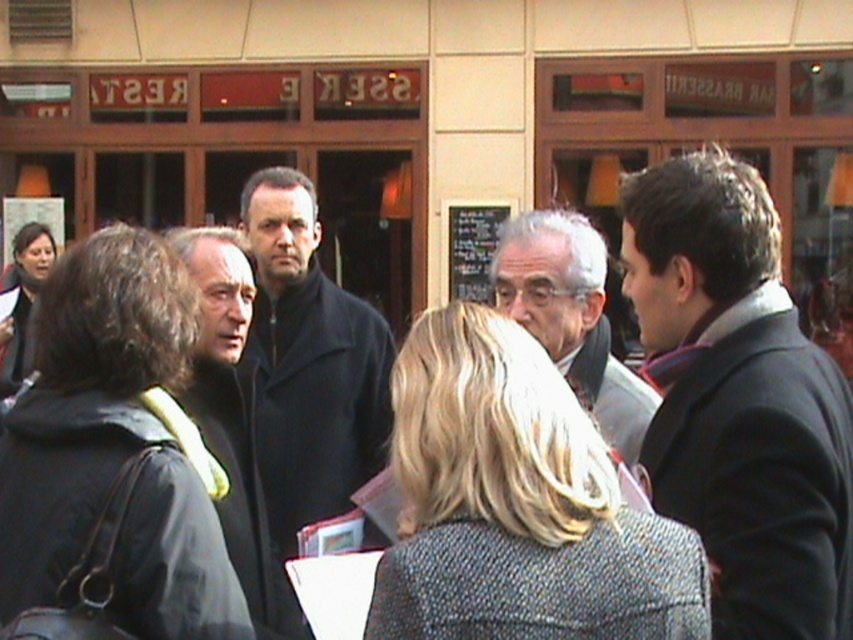
You are a GUI agent. You are given a task and a screenshot of the screen. Output one action in this format:
    pyautogui.click(x=<x>, y=<y>)
    Task: Click on the dark gray wool coat at right
    Image resolution: width=853 pixels, height=640 pixels.
    Given the screenshot: What is the action you would take?
    pyautogui.click(x=740, y=401)

Is point (679, 352) farther from viewer compared to point (283, 260)?

That is False.

Describe the element at coordinates (740, 401) in the screenshot. I see `dark gray wool coat at right` at that location.

Image resolution: width=853 pixels, height=640 pixels. Identify the location of dark gray wool coat at right. (740, 401).

What do you see at coordinates (309, 364) in the screenshot?
I see `dark matte coat at center` at bounding box center [309, 364].

Between dark matte coat at center and gray hair at center, which one is positioned higher?

gray hair at center

Does point (317, 227) come behind point (639, 419)?

That is True.

You are a GUI agent. You are given a task and a screenshot of the screen. Output one action in this format:
    pyautogui.click(x=<x>, y=<y>)
    Task: Click on the dark matte coat at center
    
    Given the screenshot: What is the action you would take?
    pyautogui.click(x=309, y=364)

Is dark gray wool coat at right to the right of gray hair at center from the viewer's perspective?

Indeed, dark gray wool coat at right is positioned on the right side of gray hair at center.

Is point (779, 365) positioned behind point (525, 294)?

No, it is not.

The image size is (853, 640). What do you see at coordinates (740, 401) in the screenshot? I see `dark gray wool coat at right` at bounding box center [740, 401].

The height and width of the screenshot is (640, 853). Identify the location of dark gray wool coat at right. (740, 401).